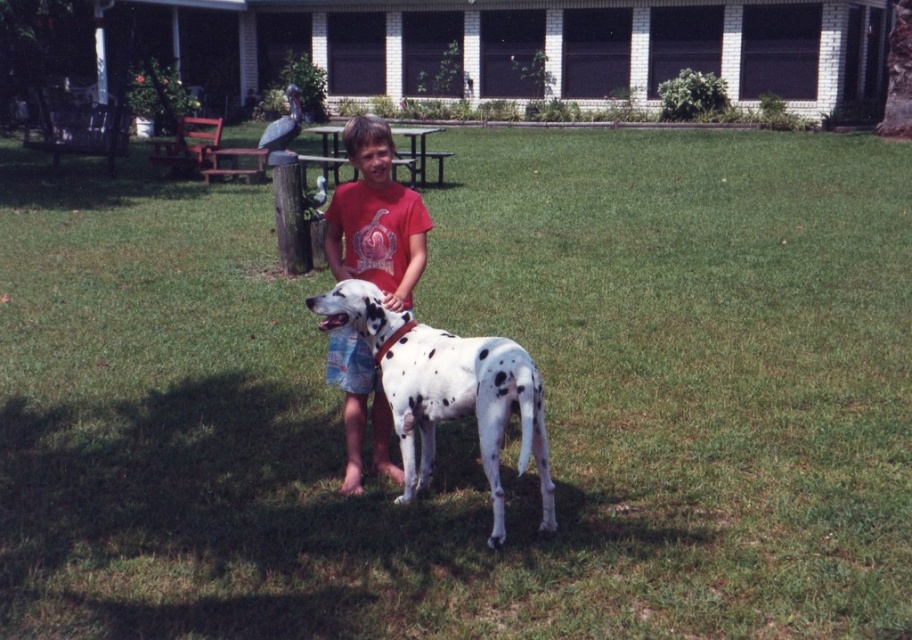
From the picture: Can you confirm if white-spotted fur dog at center is positioned above matte red t-shirt at center?

Actually, white-spotted fur dog at center is below matte red t-shirt at center.

Does white-spotted fur dog at center have a greater height compared to matte red t-shirt at center?

Yes, white-spotted fur dog at center is taller than matte red t-shirt at center.

Does point (527, 435) come behind point (329, 228)?

That is False.

Identify the location of white-spotted fur dog at center. (446, 390).